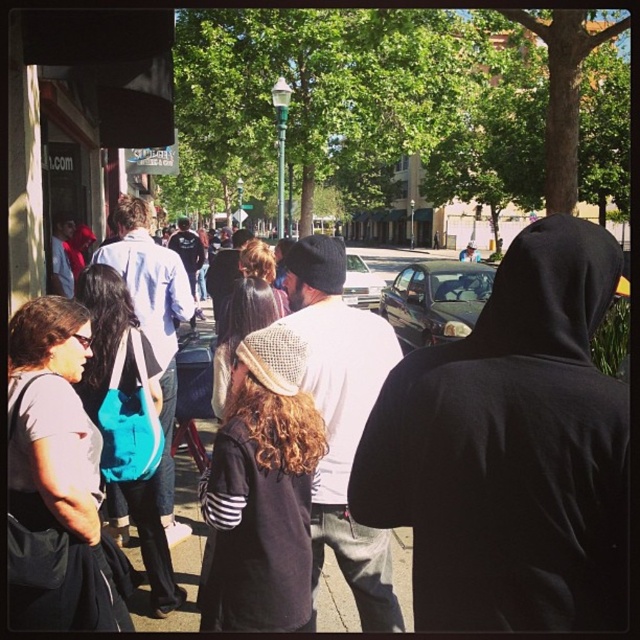
In the scene shown: You are standing on the sidewalk and see the dark brown knit cap at center. Where exactly is it positioned in relation to the other objects in the scene?

The dark brown knit cap at center is located at point 0.769 on the x axis and 0.411 on the y axis.

You are a photographer standing in the middle of the street. You want to take a photo that includes both the dark brown knit cap at center and the silver metallic sedan at center. Which object should you position closer to the edge of your camera frame to ensure both fit in the shot?

Since the dark brown knit cap at center has a lesser width compared to the silver metallic sedan at center, you should position the silver metallic sedan at center closer to the edge of your camera frame to ensure both fit in the shot.

You are a pedestrian standing on the sidewalk and see both the shiny black sedan at center and the silver metallic sedan at center. Which car is closer to you?

The shiny black sedan at center is closer to you because it is positioned further to the viewer than the silver metallic sedan at center.